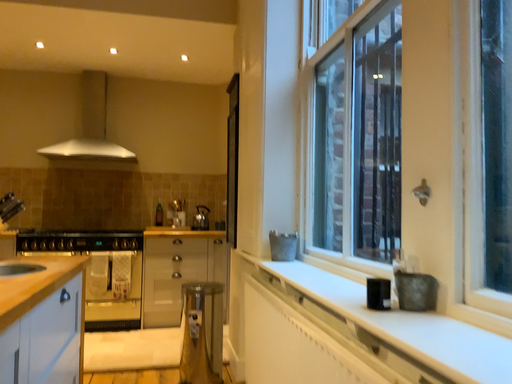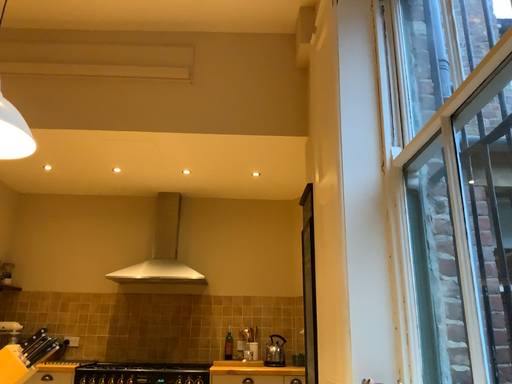
Question: Which way did the camera rotate in the video?

Choices:
 (A) rotated left
 (B) rotated right

Answer: (A)